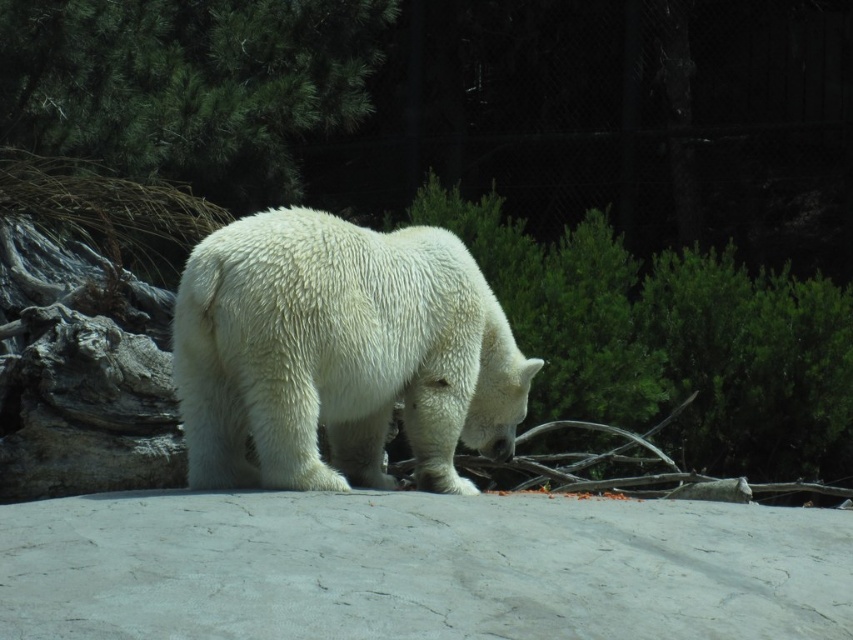
You are a zookeeper planning to feed the white fluffy bear at center and the green textured pine tree at upper left. Since the pine tree is not an animal, you only need to approach the bear. Based on their positions, which direction should you move from the pine tree to reach the bear?

The white fluffy bear at center is to the right of the green textured pine tree at upper left, so you should move to the right from the pine tree to reach the bear.

You are standing at the point marked as point (419, 300) in the zoo enclosure. You want to take a photo of the polar bear without getting too close. The zoo requires visitors to stay at least 5 meters away from the animals. Is your current position safe?

The distance between point (419, 300) and the camera is 4.78 meters. Since the required distance is 5 meters, your current position is too close to the polar bear to comply with the zoo safety rules.

You are a zookeeper planning to place a new feeding station in the enclosure. The feeding station must be placed 0.2 meters away from the white fluffy bear at center. Where should you place it?

The white fluffy bear at center is located at point (x=339, y=353). To place the feeding station 0.2 meters away, you can position it in any direction from the bear as long as it maintains that distance, ensuring it stays within the enclosure boundaries.